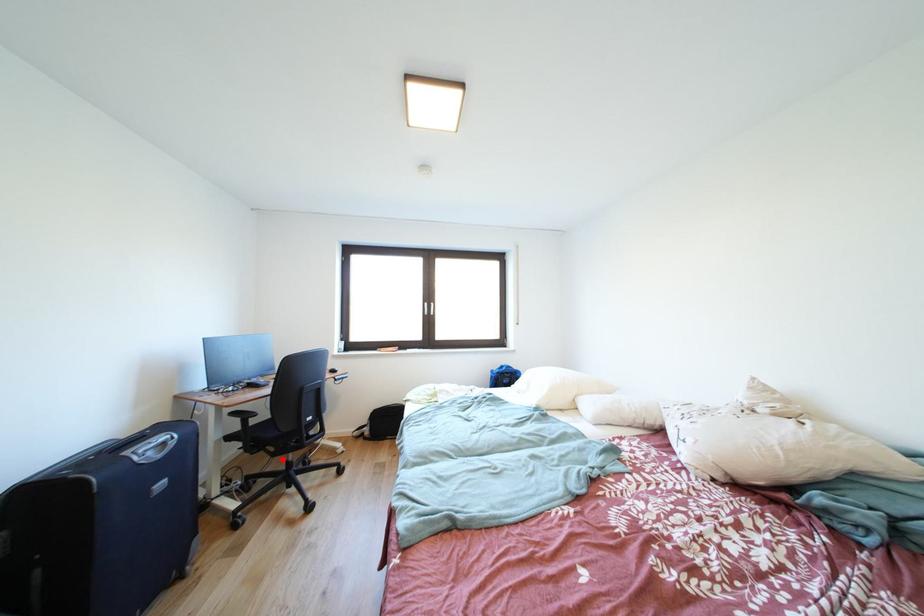
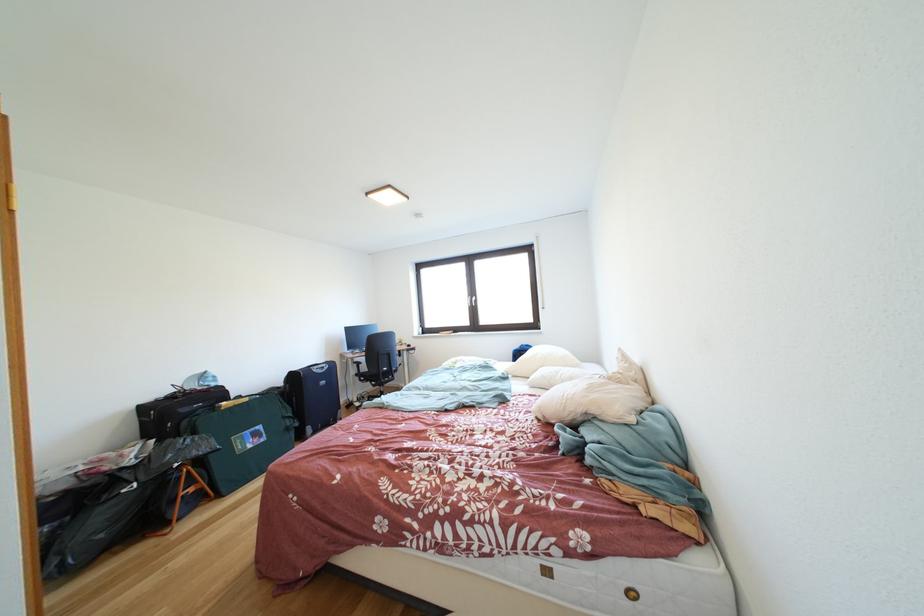
Question: I am providing you with two images of the same scene from different viewpoints. In image1, a red point is highlighted. Considering the same 3D point in image2, which of the following is correct?

Choices:
 (A) It is closer
 (B) It is farther

Answer: (B)